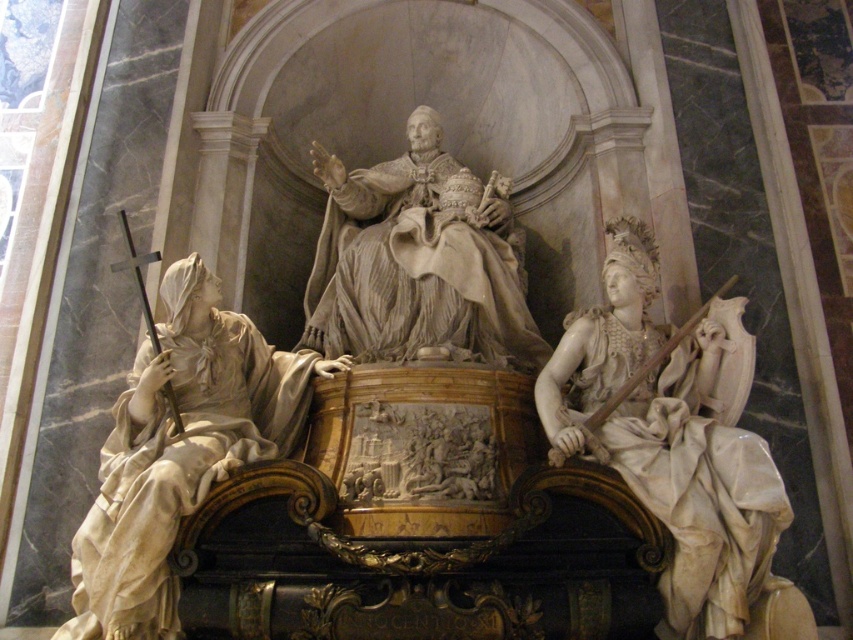
Question: Which object appears closest to the camera in this image?

Choices:
 (A) white marble statue at center
 (B) white marble statue at right
 (C) matte white statue at left

Answer: (C)

Question: Considering the real-world distances, which object is closest to the matte white statue at left?

Choices:
 (A) white marble statue at right
 (B) white marble statue at center

Answer: (B)

Question: Can you confirm if matte white statue at left is thinner than white marble statue at center?

Choices:
 (A) no
 (B) yes

Answer: (B)

Question: Where is white marble statue at right located in relation to matte white statue at left in the image?

Choices:
 (A) left
 (B) right

Answer: (B)

Question: Which object is the closest to the white marble statue at center?

Choices:
 (A) white marble statue at right
 (B) matte white statue at left

Answer: (B)

Question: Considering the relative positions of white marble statue at right and matte white statue at left in the image provided, where is white marble statue at right located with respect to matte white statue at left?

Choices:
 (A) left
 (B) right

Answer: (B)